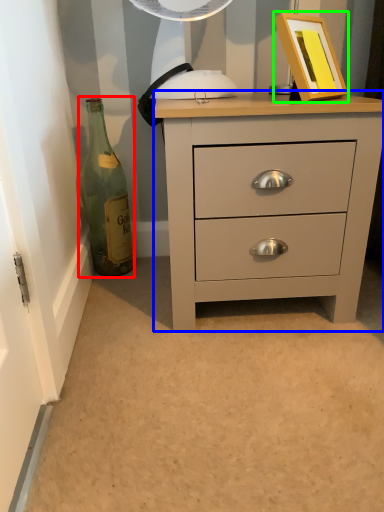
Question: Which object is the farthest from bottle (highlighted by a red box)? Choose among these: chest of drawers (highlighted by a blue box) or picture frame (highlighted by a green box).

Choices:
 (A) chest of drawers
 (B) picture frame

Answer: (B)